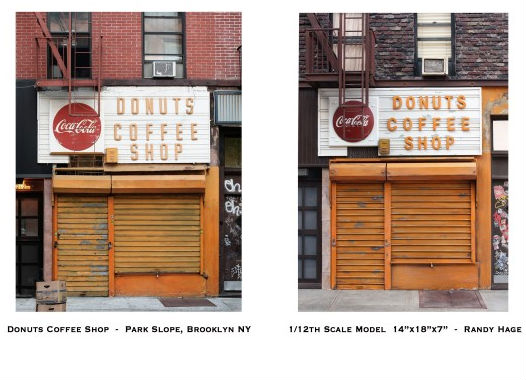
Find the location of a particular element. stickers on wall is located at coordinates (508, 209), (504, 264).